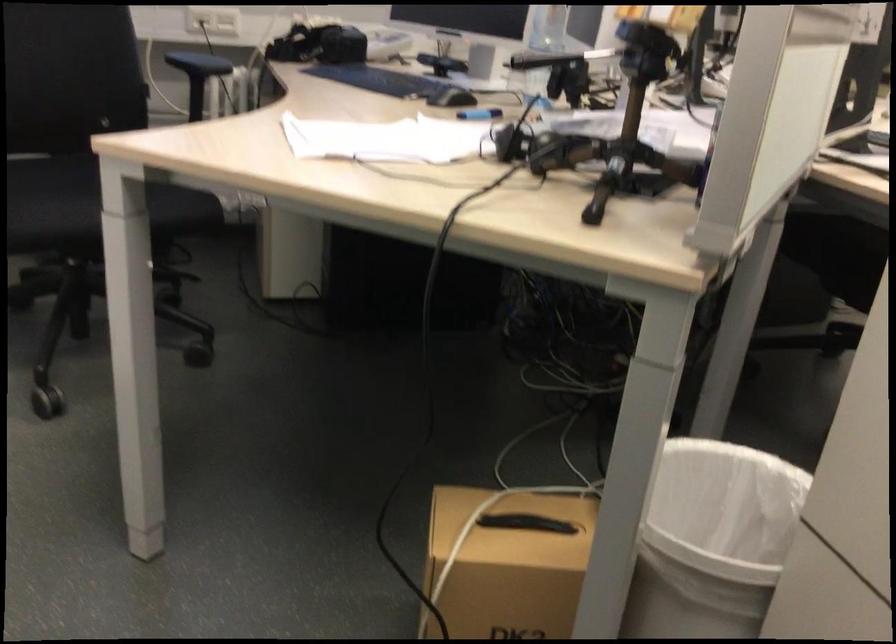
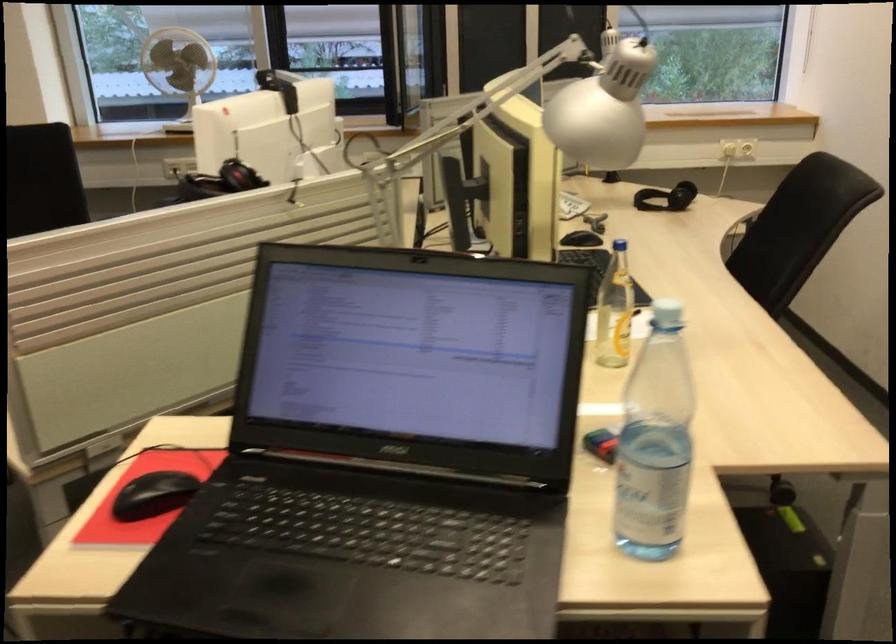
Question: The images are taken continuously from a first-person perspective. In which direction are you moving?

Choices:
 (A) Left
 (B) Right
 (C) Forward
 (D) Backward

Answer: (B)